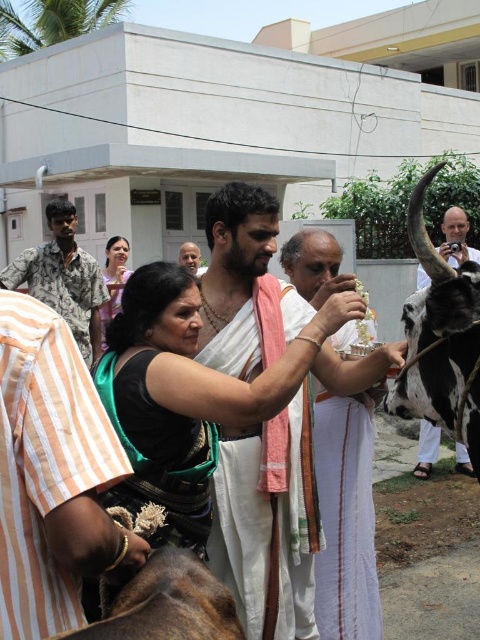
Between point (265, 561) and point (23, 266), which one is positioned behind?

The point (23, 266) is more distant.

Can you confirm if white clothed man at center is taller than camouflage-patterned shirt at left?

Correct, white clothed man at center is much taller as camouflage-patterned shirt at left.

Find the location of a particular element. This screenshot has width=480, height=640. white clothed man at center is located at coordinates (268, 522).

Who is lower down, white silk dhoti at center or smooth skin face at center?

Positioned lower is white silk dhoti at center.

Based on the photo, is white silk dhoti at center thinner than smooth skin face at center?

In fact, white silk dhoti at center might be wider than smooth skin face at center.

Is point (370, 326) more distant than point (179, 256)?

That is False.

At what (x,y) coordinates should I click in order to perform the action: click on white silk dhoti at center. Please return your answer as a coordinate pair (x, y). The height and width of the screenshot is (640, 480). Looking at the image, I should click on click(x=346, y=516).

Can you confirm if matte green saree at center is positioned above smooth skin face at center?

Incorrect, matte green saree at center is not positioned above smooth skin face at center.

Does point (112, 276) come in front of point (196, 257)?

Yes, it is in front of point (196, 257).

Is point (116, 236) closer to viewer compared to point (194, 246)?

No.

Locate an element on the screen. matte green saree at center is located at coordinates (113, 280).